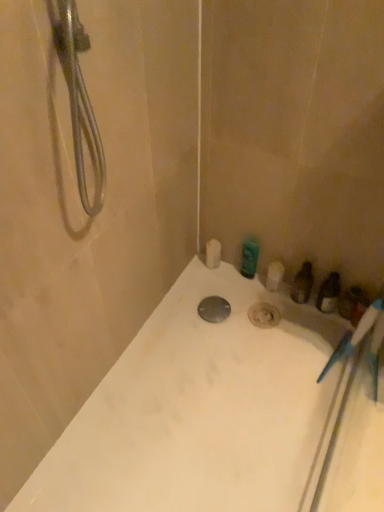
Locate an element on the screen. vacant area to the right of white matte toilet paper at upper center is located at coordinates (x=247, y=283).